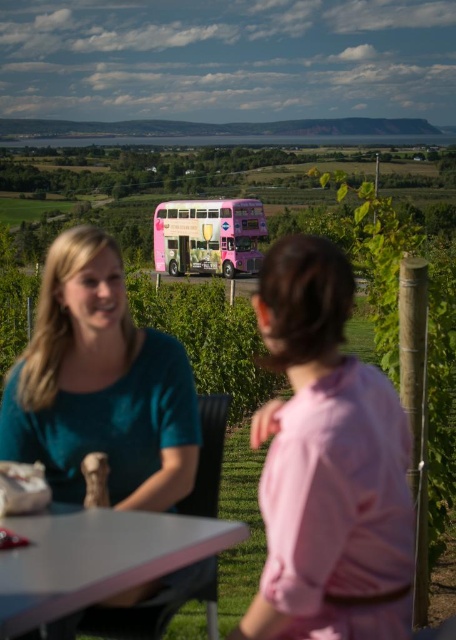
Between point (39, 330) and point (11, 528), which one is positioned in front?

Point (11, 528) is in front.

Does teal fabric shirt at center appear under white matte table at lower center?

Incorrect, teal fabric shirt at center is not positioned below white matte table at lower center.

Which is in front, point (114, 417) or point (213, 624)?

Point (114, 417) is more forward.

Identify the location of teal fabric shirt at center. The width and height of the screenshot is (456, 640). (99, 388).

Does teal fabric shirt at center come behind pink glossy double-decker bus at center?

No, it is not.

Is point (167, 417) positioned behind point (262, 225)?

No, (167, 417) is in front of (262, 225).

The height and width of the screenshot is (640, 456). I want to click on teal fabric shirt at center, so click(x=99, y=388).

Measure the distance between pink fabric shirt at center and camera.

pink fabric shirt at center and camera are 2.48 meters apart.

This screenshot has width=456, height=640. What do you see at coordinates (326, 461) in the screenshot?
I see `pink fabric shirt at center` at bounding box center [326, 461].

Does point (257, 429) come farther from viewer compared to point (228, 208)?

That is False.

The height and width of the screenshot is (640, 456). In order to click on pink fabric shirt at center in this screenshot , I will do `click(326, 461)`.